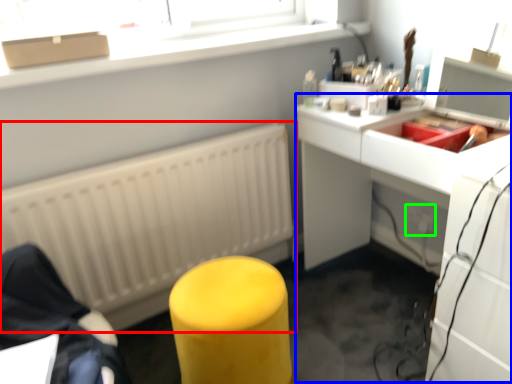
Question: Considering the real-world distances, which object is farthest from radiator (highlighted by a red box)? computer desk (highlighted by a blue box) or electric outlet (highlighted by a green box)?

Choices:
 (A) computer desk
 (B) electric outlet

Answer: (B)